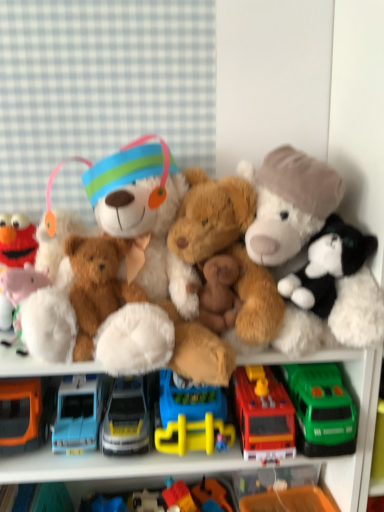
Question: Does blue plastic toy truck at center, which is the third truck in right-to-left order, have a lesser height compared to black plush cat at right, marked as the first toy in a right-to-left arrangement?

Choices:
 (A) no
 (B) yes

Answer: (B)

Question: Would you say black plush cat at right, acting as the ninth toy starting from the left, is part of blue plastic toy truck at center, which is the third truck in right-to-left order,'s contents?

Choices:
 (A) no
 (B) yes

Answer: (A)

Question: Is blue plastic toy truck at center, placed as the 3th truck when sorted from left to right, wider than black plush cat at right, marked as the first toy in a right-to-left arrangement?

Choices:
 (A) no
 (B) yes

Answer: (B)

Question: From the image's perspective, would you say blue plastic toy truck at center, placed as the 3th truck when sorted from left to right, is shown under black plush cat at right, acting as the ninth toy starting from the left?

Choices:
 (A) no
 (B) yes

Answer: (B)

Question: From a real-world perspective, is blue plastic toy truck at center, which is the third truck in right-to-left order, located higher than black plush cat at right, acting as the ninth toy starting from the left?

Choices:
 (A) no
 (B) yes

Answer: (A)

Question: Considering the positions of fluffy brown teddy bear at center, marked as the 7th toy in a left-to-right arrangement, and white plush pig at left, placed as the 1th toy when sorted from left to right, in the image, is fluffy brown teddy bear at center, marked as the 7th toy in a left-to-right arrangement, wider or thinner than white plush pig at left, placed as the 1th toy when sorted from left to right,?

Choices:
 (A) thin
 (B) wide

Answer: (B)

Question: Visually, is fluffy brown teddy bear at center, marked as the 7th toy in a left-to-right arrangement, positioned to the left or to the right of white plush pig at left, placed as the 9th toy when sorted from right to left?

Choices:
 (A) right
 (B) left

Answer: (A)

Question: From the image's perspective, relative to white plush pig at left, placed as the 1th toy when sorted from left to right, is fluffy brown teddy bear at center, marked as the 7th toy in a left-to-right arrangement, above or below?

Choices:
 (A) below
 (B) above

Answer: (B)

Question: Is fluffy brown teddy bear at center, marked as the 7th toy in a left-to-right arrangement, taller or shorter than white plush pig at left, placed as the 1th toy when sorted from left to right?

Choices:
 (A) tall
 (B) short

Answer: (A)

Question: Is point (192, 495) positioned closer to the camera than point (304, 184)?

Choices:
 (A) farther
 (B) closer

Answer: (A)

Question: From the image's perspective, is rubber duck at center, the fourth toy viewed from the right, located above or below fluffy white stuffed animal at right, the 2th toy in the right-to-left sequence?

Choices:
 (A) below
 (B) above

Answer: (A)

Question: From their relative heights in the image, would you say rubber duck at center, marked as the 6th toy in a left-to-right arrangement, is taller or shorter than fluffy white stuffed animal at right, which is the 8th toy from left to right?

Choices:
 (A) tall
 (B) short

Answer: (B)

Question: In terms of width, does rubber duck at center, marked as the 6th toy in a left-to-right arrangement, look wider or thinner when compared to fluffy white stuffed animal at right, which is the 8th toy from left to right?

Choices:
 (A) thin
 (B) wide

Answer: (A)

Question: Is point (82, 377) closer or farther from the camera than point (185, 200)?

Choices:
 (A) closer
 (B) farther

Answer: (B)

Question: In terms of height, does blue plastic toy truck at center, placed as the 1th truck when sorted from left to right, look taller or shorter compared to fluffy brown teddy bear at center, the 3th toy positioned from the right?

Choices:
 (A) tall
 (B) short

Answer: (B)